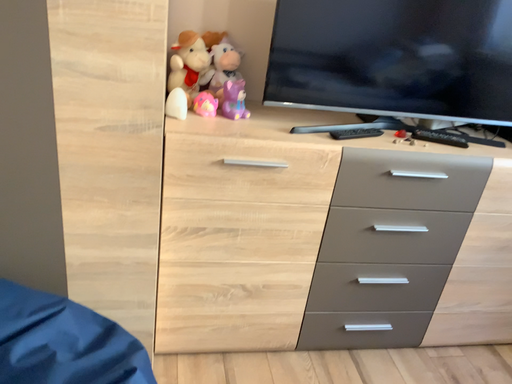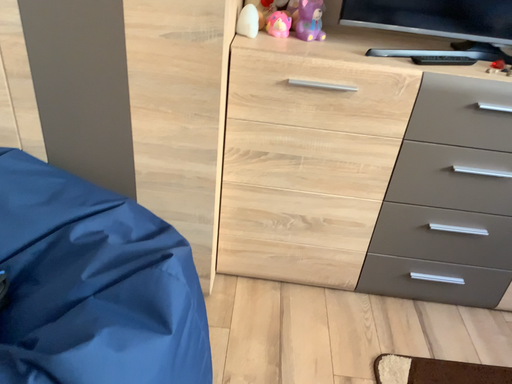
Question: Which way did the camera rotate in the video?

Choices:
 (A) rotated right
 (B) rotated left

Answer: (B)